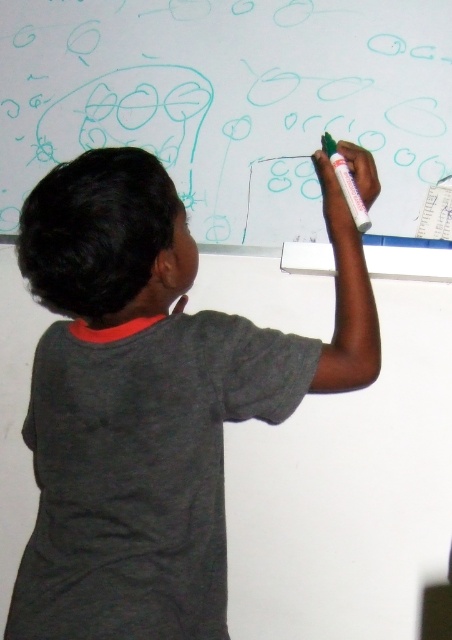
Question: Does dark gray t-shirt at upper center have a greater width compared to green matte marker at upper center?

Choices:
 (A) no
 (B) yes

Answer: (B)

Question: Which point appears farthest from the camera in this image?

Choices:
 (A) (321, 134)
 (B) (250, 134)
 (C) (127, 348)

Answer: (B)

Question: Does dark gray t-shirt at upper center have a larger size compared to green matte marker at upper center?

Choices:
 (A) no
 (B) yes

Answer: (B)

Question: Which of these objects is positioned farthest from the dark gray t-shirt at upper center?

Choices:
 (A) whiteboard at upper center
 (B) green matte marker at upper center

Answer: (B)

Question: Is whiteboard at upper center to the left of green matte marker at upper center from the viewer's perspective?

Choices:
 (A) yes
 (B) no

Answer: (A)

Question: Estimate the real-world distances between objects in this image. Which object is closer to the green matte marker at upper center?

Choices:
 (A) dark gray t-shirt at upper center
 (B) whiteboard at upper center

Answer: (B)